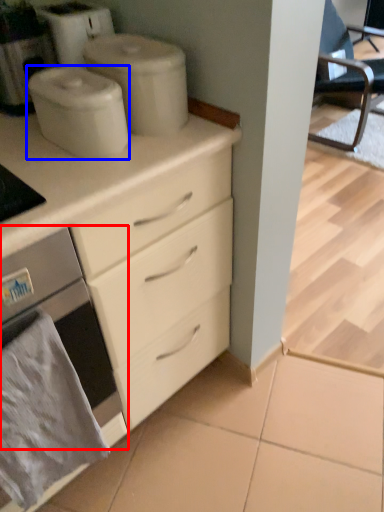
Question: Which object appears farthest to the camera in this image, home appliance (highlighted by a red box) or appliance (highlighted by a blue box)?

Choices:
 (A) home appliance
 (B) appliance

Answer: (B)